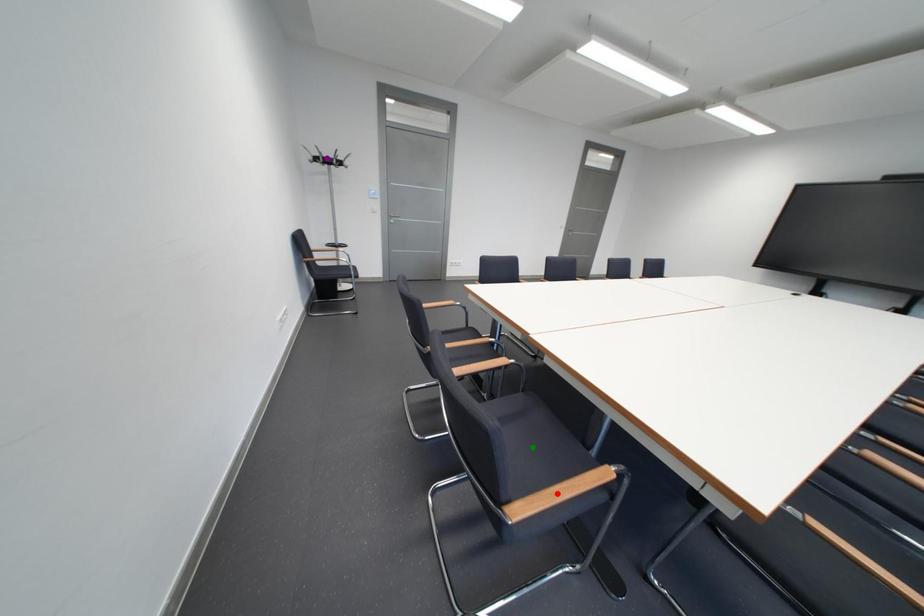
Order these from farthest to nearest:
purple point | green point | red point

purple point
green point
red point